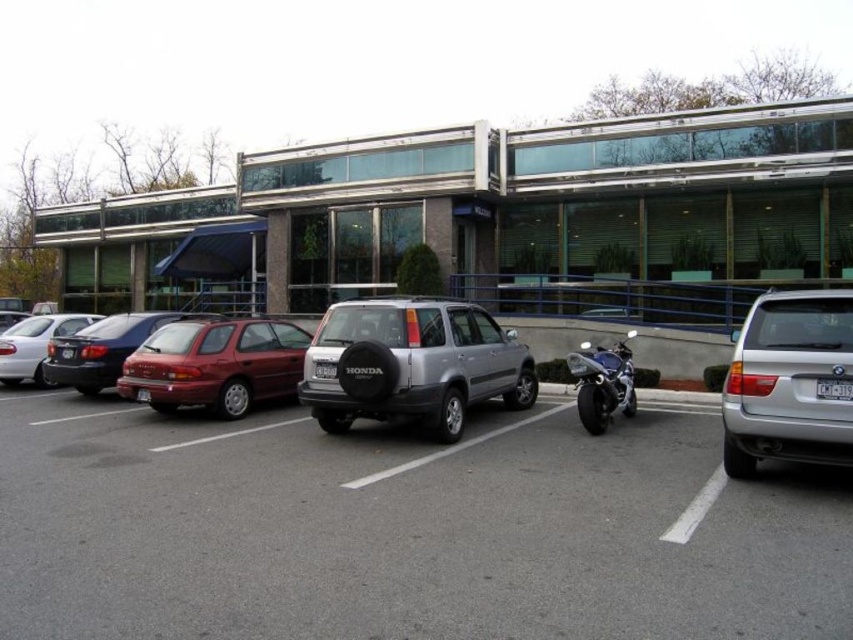
Can you confirm if silver metallic car at center is wider than matte red hatchback at center-left?

No.

Is silver metallic car at center taller than matte red hatchback at center-left?

In fact, silver metallic car at center may be shorter than matte red hatchback at center-left.

Find the location of a particular element. The width and height of the screenshot is (853, 640). silver metallic car at center is located at coordinates (405, 531).

What are the coordinates of `silver metallic car at center` in the screenshot? It's located at (405, 531).

Is the position of silver metallic suv at right less distant than that of matte silver sedan at left?

Yes.

Based on the photo, is silver metallic suv at right smaller than matte silver sedan at left?

Correct, silver metallic suv at right occupies less space than matte silver sedan at left.

Between point (817, 333) and point (12, 321), which one is positioned in front?

Point (817, 333)

I want to click on silver metallic suv at right, so click(x=788, y=381).

Who is positioned more to the right, silver metallic suv at right or black plastic license plate at center?

black plastic license plate at center

Is point (770, 292) more distant than point (840, 390)?

Yes, point (770, 292) is behind point (840, 390).

The image size is (853, 640). I want to click on silver metallic suv at right, so click(x=788, y=381).